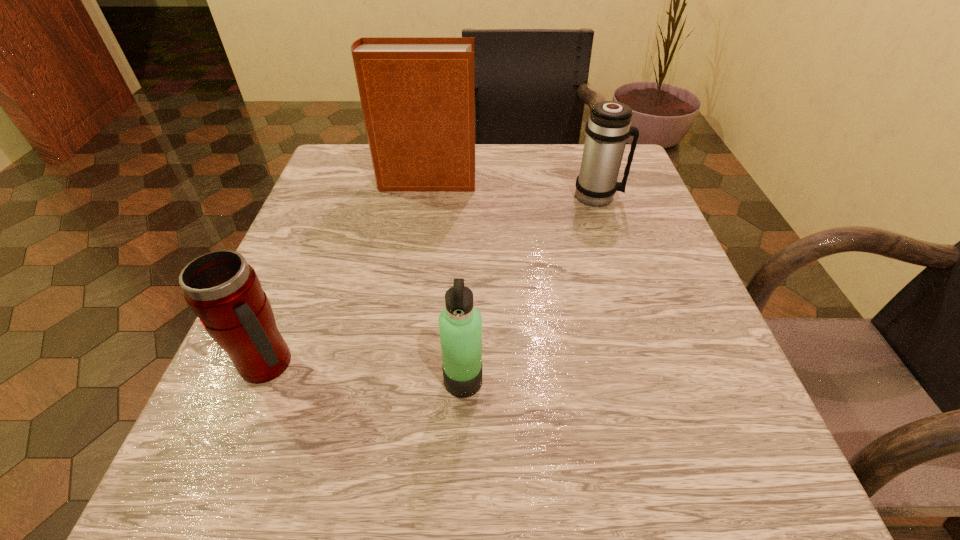
I want to click on hardback book, so click(x=417, y=94).

Find the location of `the second thermos bottle from right to left`. the second thermos bottle from right to left is located at coordinates (x=460, y=324).

Find the location of a particular element. Image resolution: width=960 pixels, height=540 pixels. the farthest thermos bottle is located at coordinates (x=608, y=128).

Find the location of a particular element. the rightmost object is located at coordinates (608, 128).

The width and height of the screenshot is (960, 540). In order to click on the leftmost thermos bottle in this screenshot , I will do (x=224, y=291).

At what (x,y) coordinates should I click in order to perform the action: click on vacant space located 0.330m on the open cover of the tallest object. Please return your answer as a coordinate pair (x, y). The image size is (960, 540). Looking at the image, I should click on (622, 181).

The image size is (960, 540). Find the location of `free space located 0.140m on the front of the second thermos bottle from left to right`. free space located 0.140m on the front of the second thermos bottle from left to right is located at coordinates (459, 507).

Where is `vacant space located 0.170m on the side with the handle of the leftmost thermos bottle`? vacant space located 0.170m on the side with the handle of the leftmost thermos bottle is located at coordinates (416, 364).

Identify the location of hardback book at the far edge. This screenshot has height=540, width=960. (417, 94).

Where is `thermos bottle at the far edge`? This screenshot has width=960, height=540. thermos bottle at the far edge is located at coordinates (608, 128).